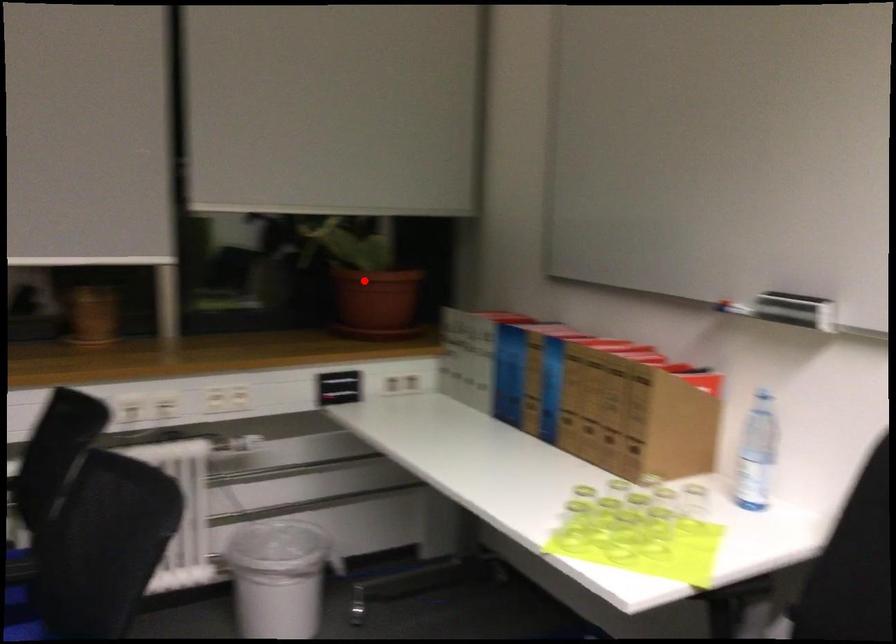
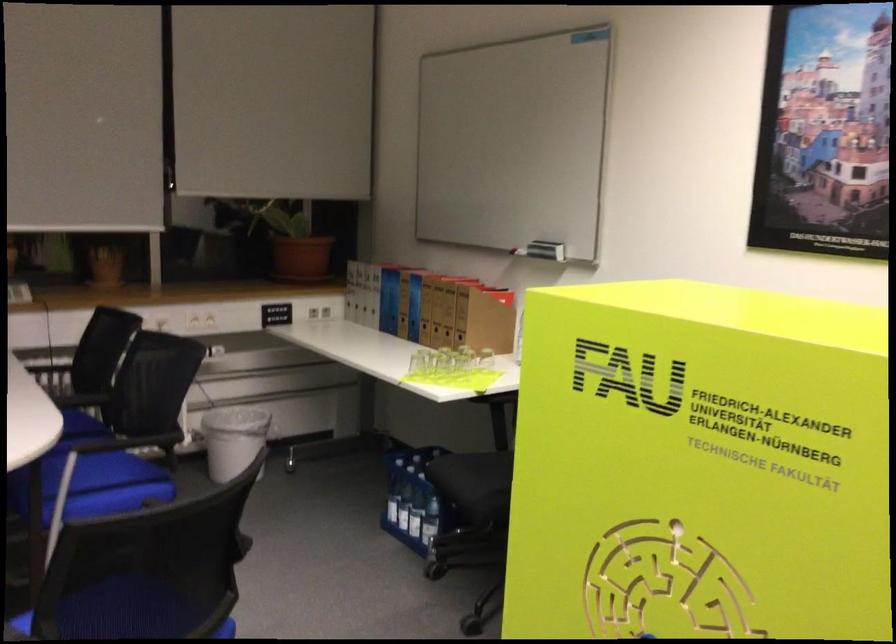
Question: I am providing you with two images of the same scene from different viewpoints. A red point is marked on the first image. Is the red point's position out of view in image 2?

Choices:
 (A) Yes
 (B) No

Answer: (B)